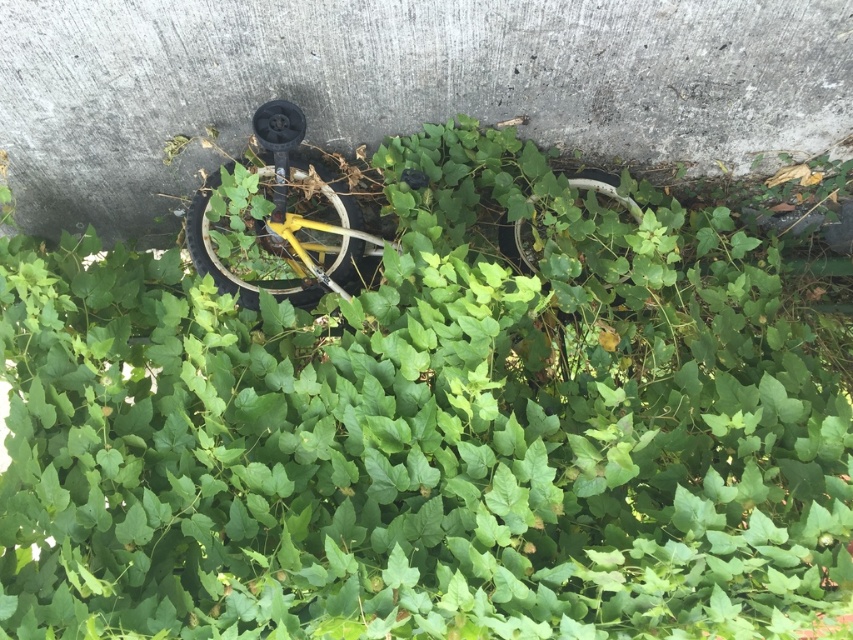
Can you confirm if gray concrete at center is smaller than yellow matte bicycle wheel at center?

Incorrect, gray concrete at center is not smaller in size than yellow matte bicycle wheel at center.

Between gray concrete at center and yellow matte bicycle wheel at center, which one appears on the left side from the viewer's perspective?

From the viewer's perspective, yellow matte bicycle wheel at center appears more on the left side.

The height and width of the screenshot is (640, 853). I want to click on gray concrete at center, so click(x=401, y=84).